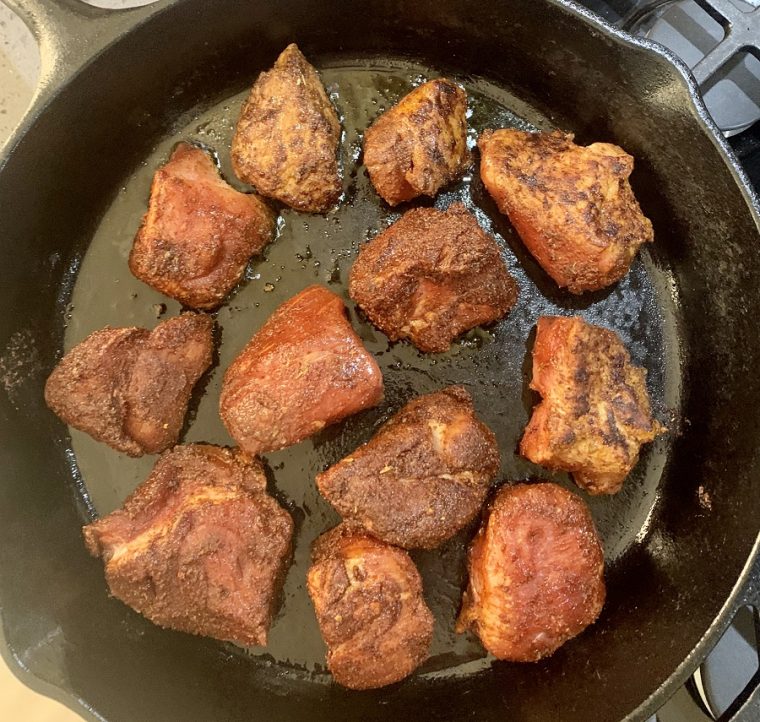
I want to click on range, so click(x=722, y=40).